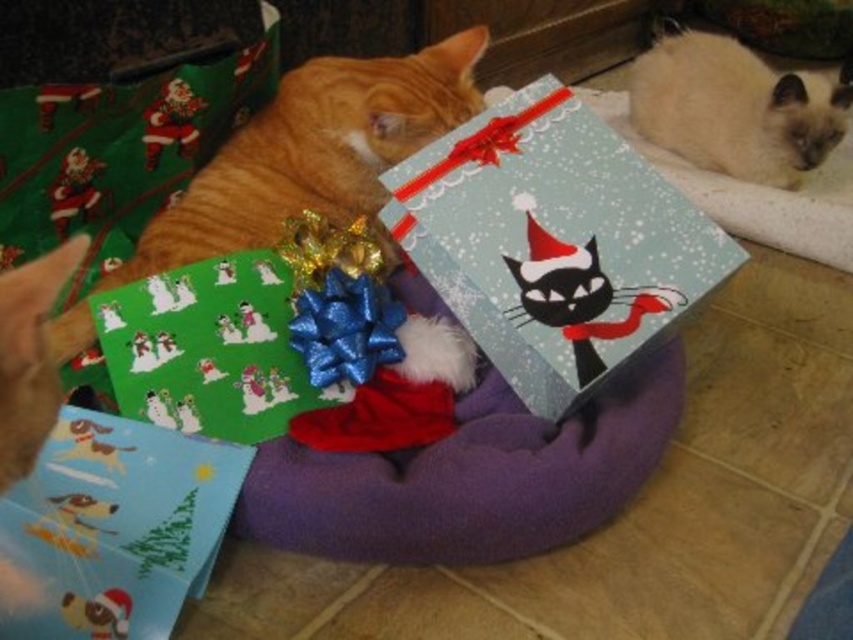
You are a delivery person who just arrived with a new gift. You need to place it next to the matte paper gift at lower left without touching the orange fur cat at upper left. Considering their sizes, can you fit the new gift there?

The orange fur cat at upper left is wider than the matte paper gift at lower left. Therefore, there should be enough space to place the new gift next to the matte paper gift at lower left without touching the cat.

You are a delivery person who just arrived at the house. You see the matte blue paper at center and the matte paper gift at lower left. Which gift is closer to the floor?

The matte paper gift at lower left is closer to the floor because it is located below the matte blue paper at center.

You are a delivery person who just arrived at the house. You see an orange fur cat at upper left and a matte paper gift at lower left. Which one is larger in size?

The orange fur cat at upper left is bigger than the matte paper gift at lower left.